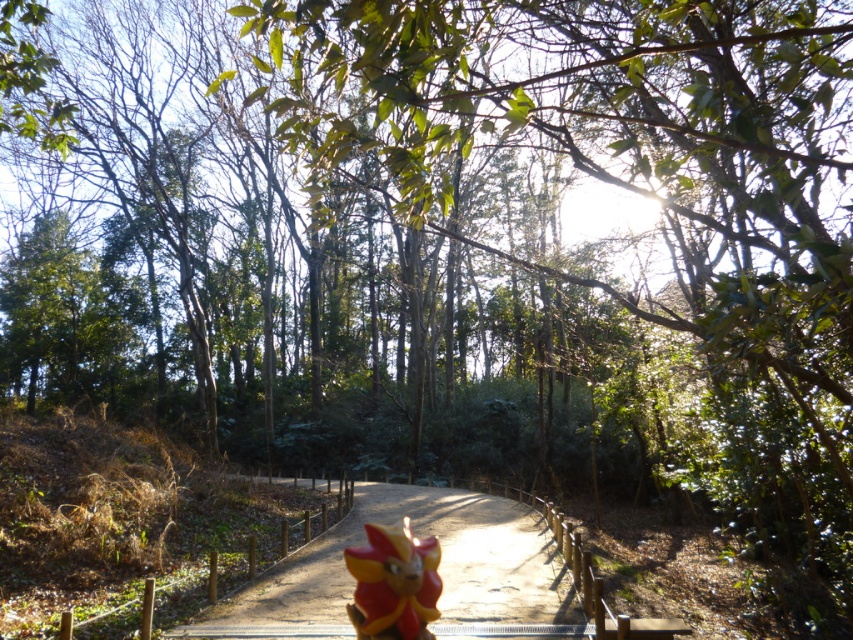
You are standing at the entrance of the forest and see the smooth wooden path at center. If you walk straight ahead, will you stay on the path?

Yes, because the smooth wooden path at center is positioned at point (438, 572), which is directly in front of you, so walking straight ahead will keep you on the path.